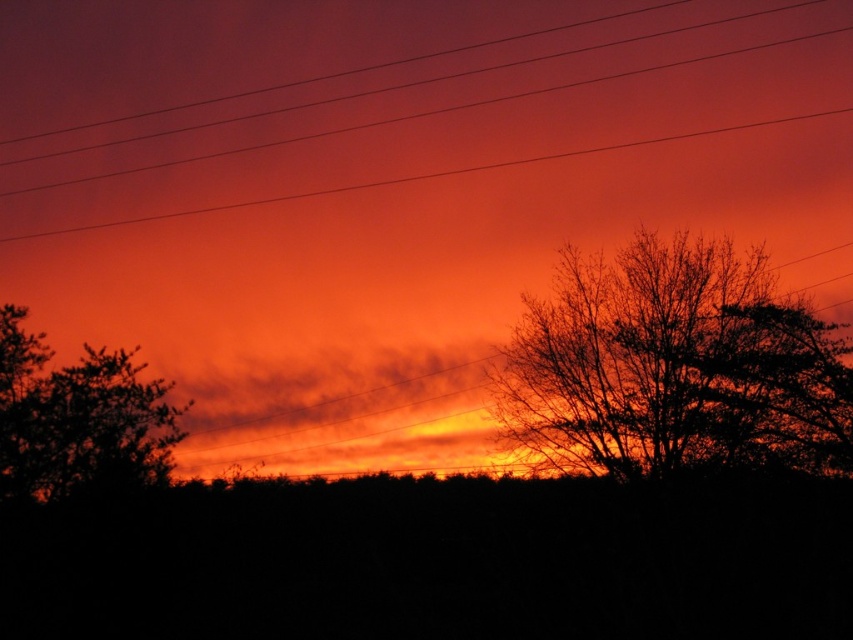
Question: Which object appears closest to the camera in this image?

Choices:
 (A) silhouette tree at left
 (B) silhouette tree at right

Answer: (A)

Question: Is the position of silhouette tree at right more distant than that of smooth wire at upper center?

Choices:
 (A) no
 (B) yes

Answer: (A)

Question: Which is farther from the smooth wire at upper center?

Choices:
 (A) silhouette tree at left
 (B) silhouette tree at right

Answer: (A)

Question: Is silhouette tree at left above smooth wire at upper center?

Choices:
 (A) yes
 (B) no

Answer: (B)

Question: Is silhouette tree at right further to camera compared to silhouette tree at left?

Choices:
 (A) yes
 (B) no

Answer: (A)

Question: Estimate the real-world distances between objects in this image. Which object is closer to the smooth wire at upper center?

Choices:
 (A) silhouette tree at right
 (B) silhouette tree at left

Answer: (A)